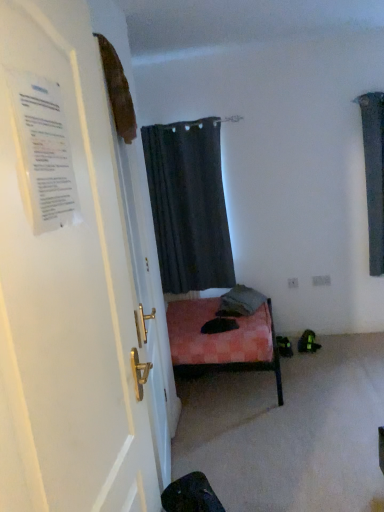
The height and width of the screenshot is (512, 384). I want to click on white glossy door at left, so click(68, 295).

Image resolution: width=384 pixels, height=512 pixels. I want to click on white paper at left, so click(x=42, y=152).

From the image's perspective, is white glossy door at left located above white paper at left?

No, from the image's perspective, white glossy door at left is not on top of white paper at left.

Which object is closer to the camera, white glossy door at left or white paper at left?

white glossy door at left is more forward.

Who is bigger, white glossy door at left or white paper at left?

white glossy door at left is bigger.

Can you confirm if white glossy door at left is shorter than white paper at left?

No.

From a real-world perspective, does white glossy door at left stand above dark gray fabric curtain at upper center?

Indeed, from a real-world perspective, white glossy door at left stands above dark gray fabric curtain at upper center.

Is white glossy door at left placed right next to dark gray fabric curtain at upper center?

No, white glossy door at left is not making contact with dark gray fabric curtain at upper center.

Considering the positions of objects white glossy door at left and dark gray fabric curtain at upper center in the image provided, who is more to the right, white glossy door at left or dark gray fabric curtain at upper center?

dark gray fabric curtain at upper center.

Which point is more forward, [34,63] or [164,175]?

The point [34,63] is more forward.

This screenshot has width=384, height=512. What are the coordinates of `poster that is in front of the dark gray fabric curtain at upper center` in the screenshot? It's located at (42, 152).

Is dark gray fabric curtain at upper center oriented away from white paper at left?

dark gray fabric curtain at upper center is not turned away from white paper at left.

Which is correct: dark gray fabric curtain at upper center is inside white paper at left, or outside of it?

dark gray fabric curtain at upper center is not enclosed by white paper at left.

From a real-world perspective, is dark gray fabric curtain at upper center located higher than white glossy door at left?

No, from a real-world perspective, dark gray fabric curtain at upper center is not over white glossy door at left

Considering the sizes of objects dark gray fabric curtain at upper center and white glossy door at left in the image provided, who is taller, dark gray fabric curtain at upper center or white glossy door at left?

white glossy door at left is taller.

Is dark gray fabric curtain at upper center wider or thinner than white glossy door at left?

In the image, dark gray fabric curtain at upper center appears to be wider than white glossy door at left.

Can you confirm if dark gray fabric curtain at upper center is bigger than white glossy door at left?

Yes.

From the image's perspective, is white paper at left below white glossy door at left?

No.

Who is bigger, white paper at left or white glossy door at left?

With larger size is white glossy door at left.

Is white paper at left next to white glossy door at left and touching it?

white paper at left and white glossy door at left are clearly separated.

From a real-world perspective, is white paper at left positioned under dark gray fabric curtain at upper center based on gravity?

Incorrect, from a real-world perspective, white paper at left is higher than dark gray fabric curtain at upper center.

Is the position of white paper at left less distant than that of dark gray fabric curtain at upper center?

That is True.

Is white paper at left spatially inside dark gray fabric curtain at upper center, or outside of it?

white paper at left cannot be found inside dark gray fabric curtain at upper center.

Considering the relative positions of white paper at left and dark gray fabric curtain at upper center in the image provided, is white paper at left to the right of dark gray fabric curtain at upper center from the viewer's perspective?

Incorrect, white paper at left is not on the right side of dark gray fabric curtain at upper center.

Locate an element on the screen. Image resolution: width=384 pixels, height=512 pixels. door below the white paper at left (from the image's perspective) is located at coordinates (68, 295).

Identify the location of door that appears in front of the dark gray fabric curtain at upper center. This screenshot has width=384, height=512. (68, 295).

From the image, which object appears to be nearer to white paper at left, white glossy door at left or dark gray fabric curtain at upper center?

Among the two, white glossy door at left is located nearer to white paper at left.

When comparing their distances from white glossy door at left, does dark gray fabric curtain at upper center or white paper at left seem further?

Based on the image, dark gray fabric curtain at upper center appears to be further to white glossy door at left.

Considering their positions, is white paper at left positioned further to white glossy door at left than dark gray fabric curtain at upper center?

The object further to white glossy door at left is dark gray fabric curtain at upper center.

Based on the photo, considering their positions, is white paper at left positioned closer to dark gray fabric curtain at upper center than white glossy door at left?

white glossy door at left is closer to dark gray fabric curtain at upper center.

Based on their spatial positions, is white glossy door at left or white paper at left further from dark gray fabric curtain at upper center?

white paper at left is further to dark gray fabric curtain at upper center.

From the image, which object appears to be nearer to white paper at left, dark gray fabric curtain at upper center or white glossy door at left?

white glossy door at left is closer to white paper at left.

Locate an element on the screen. The image size is (384, 512). poster between white glossy door at left and dark gray fabric curtain at upper center along the z-axis is located at coordinates (42, 152).